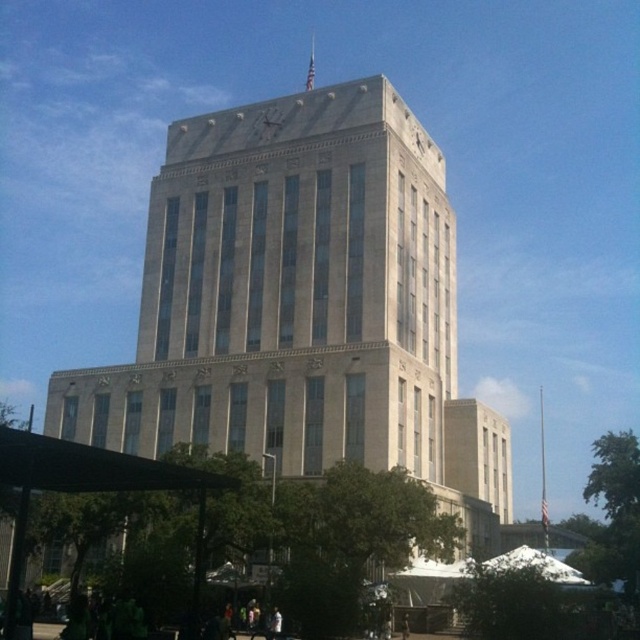
You are standing in front of the building and want to take a photo of the beige stone tower at center and the white fabric canopy at lower center. Which object should you focus on first if you want to capture both in the same frame without moving the camera?

The beige stone tower at center is positioned on the left side of the white fabric canopy at lower center, so you should focus on the beige stone tower at center first to ensure both objects are in the frame.

You are a construction worker tasked with installing a new light pole between the beige stone tower at center and the white fabric canopy at lower center. The light pole requires a minimum of 10 meters of space between the two objects to be safely installed. Based on the scene description, can the light pole be placed between them?

The beige stone tower at center and white fabric canopy at lower center are 23.28 meters apart, which is more than the required 10 meters. Therefore, the light pole can be safely installed between them.

You are standing in front of the building and notice a specific point marked at coordinates point (x=301, y=307). Based on the scene description, can you identify which part of the building this point corresponds to?

The point (x=301, y=307) is on beige stone tower at center.